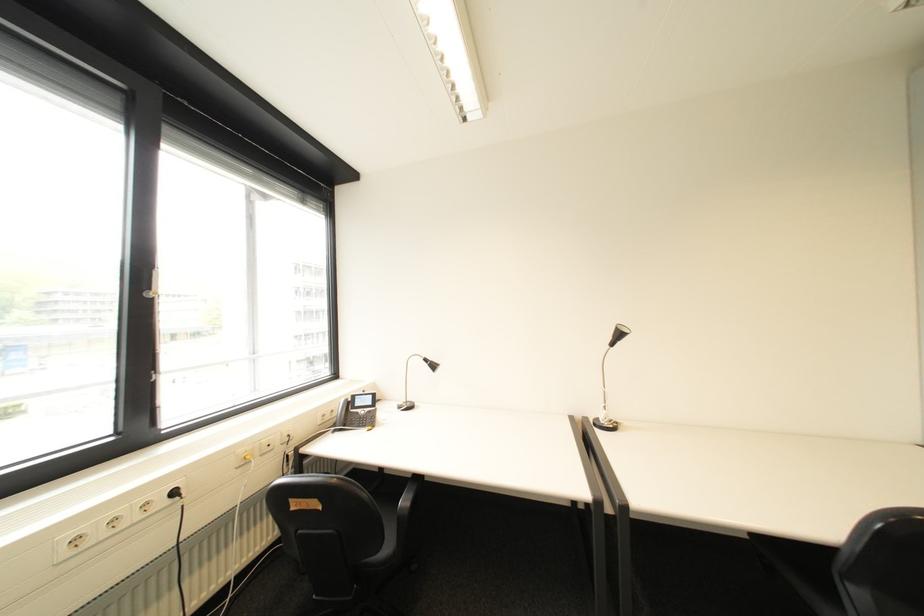
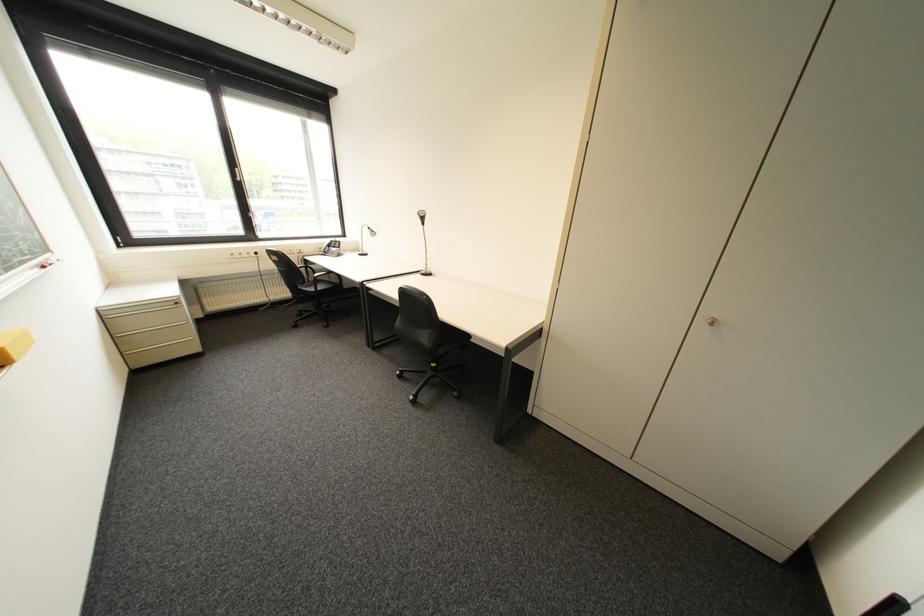
The point at (160, 294) is marked in the first image. Where is the corresponding point in the second image?

(249, 180)